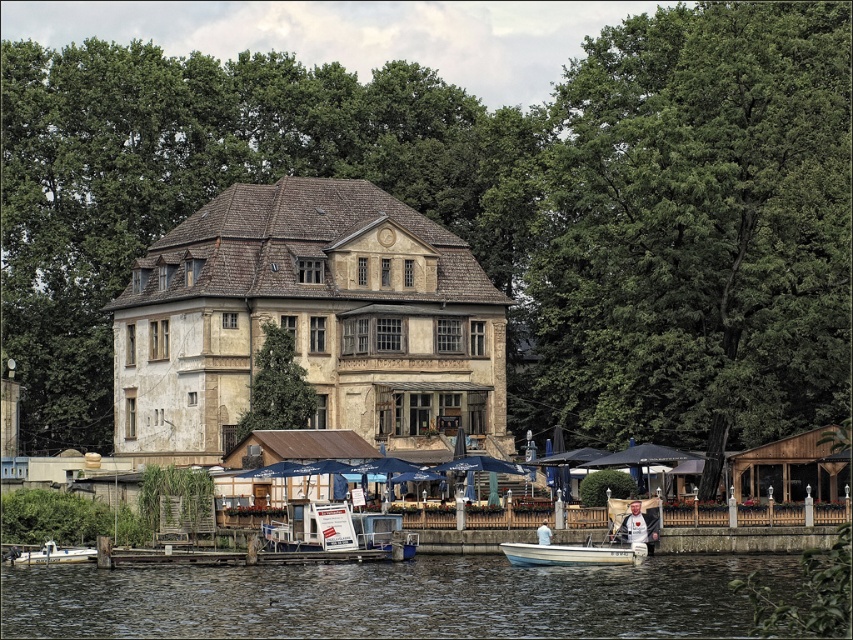
Is white plastic boat at lower left smaller than white cotton shirt at lower center?

No, white plastic boat at lower left is not smaller than white cotton shirt at lower center.

Describe the element at coordinates (53, 554) in the screenshot. I see `white plastic boat at lower left` at that location.

The image size is (853, 640). What are the coordinates of `white plastic boat at lower left` in the screenshot? It's located at (53, 554).

Who is higher up, white matte boat at lower center or white fabric shirt at lower center?

white fabric shirt at lower center is above.

Can you confirm if white matte boat at lower center is positioned to the left of white fabric shirt at lower center?

Yes, white matte boat at lower center is to the left of white fabric shirt at lower center.

Between point (595, 563) and point (643, 528), which one is positioned in front?

Point (595, 563) is more forward.

Identify the location of white matte boat at lower center. (572, 554).

Does white plastic boat at lower left appear over white fabric shirt at lower center?

No, white plastic boat at lower left is not above white fabric shirt at lower center.

Does point (55, 556) come in front of point (634, 541)?

That is False.

Between point (86, 547) and point (636, 525), which one is positioned in front?

Point (636, 525) is more forward.

Where is `white plastic boat at lower left`? This screenshot has height=640, width=853. white plastic boat at lower left is located at coordinates (53, 554).